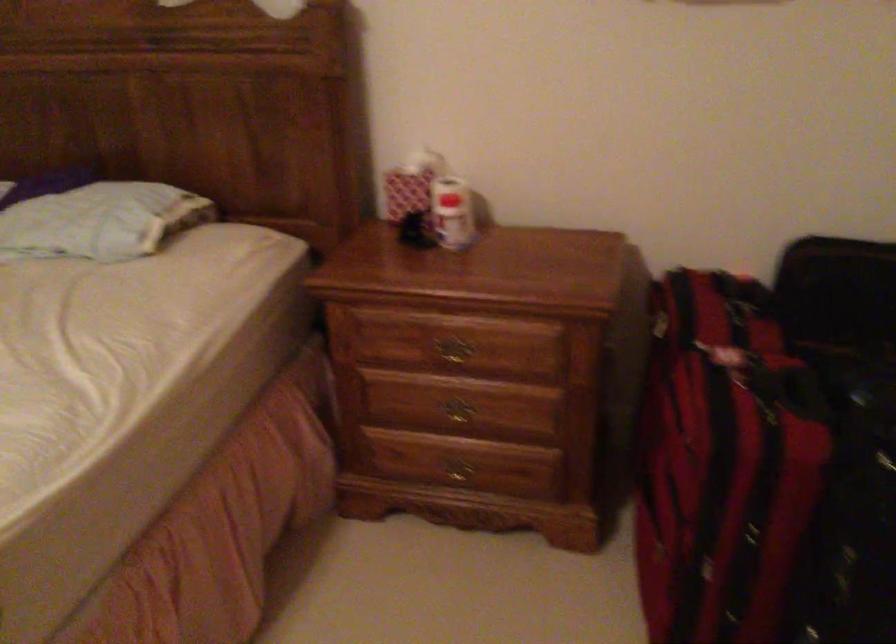
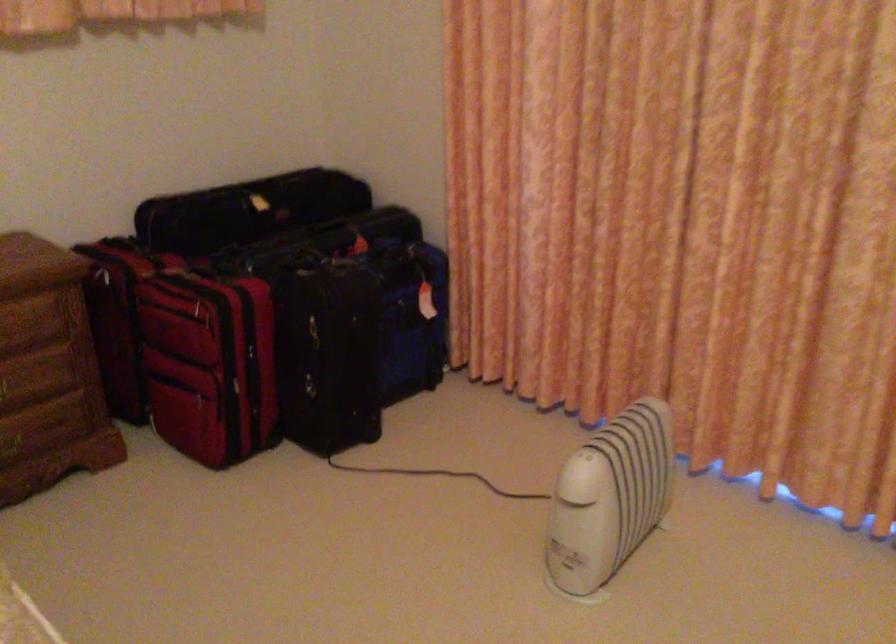
The point at (x=487, y=345) is marked in the first image. Where is the corresponding point in the second image?

(14, 319)